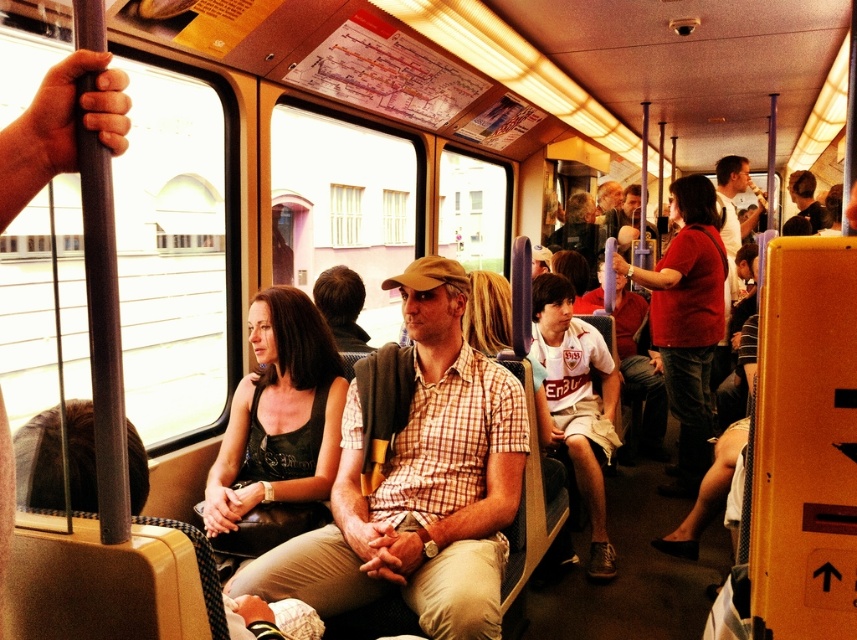
Question: Which point is closer to the camera taking this photo?

Choices:
 (A) (620, 218)
 (B) (820, 218)
 (C) (574, 218)
 (D) (322, 428)

Answer: (D)

Question: Which of the following is the farthest from the observer?

Choices:
 (A) matte brown cap at center
 (B) light brown plaid shirt at center

Answer: (A)

Question: Which object appears farthest from the camera in this image?

Choices:
 (A) light brown plaid shirt at center
 (B) matte black tank top at center

Answer: (A)

Question: Can you confirm if matte black tank top at center is thinner than matte brown cap at center?

Choices:
 (A) yes
 (B) no

Answer: (A)

Question: Does matte white shirt at center appear under dark brown hair at upper right?

Choices:
 (A) no
 (B) yes

Answer: (B)

Question: Does matte black tank top at center appear on the right side of dark brown hair at upper right?

Choices:
 (A) no
 (B) yes

Answer: (A)